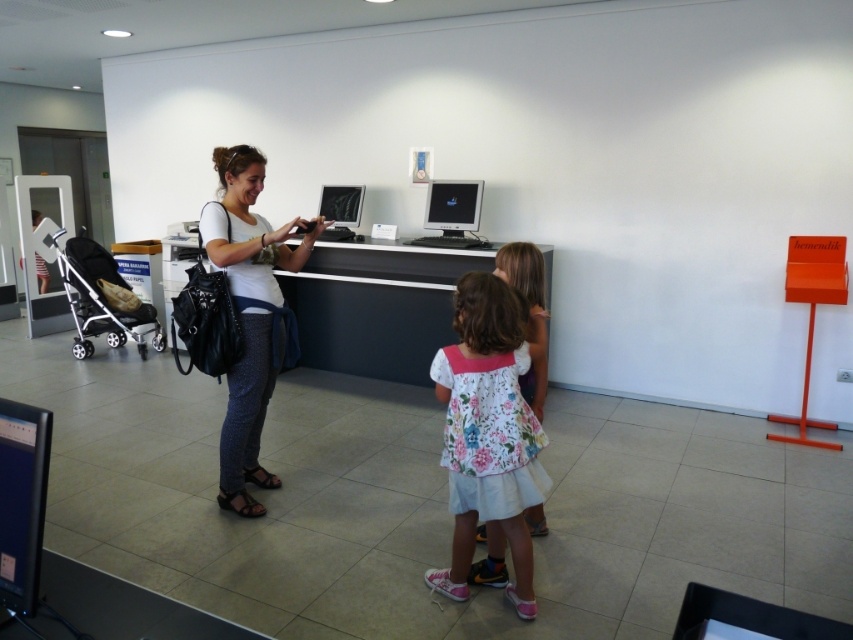
You are standing in the reception area and want to take a photo of both the point at coordinates (498, 320) and the point at coordinates (309, 221). Which point should you focus on first to ensure both are in clear view?

You should focus on point (498, 320) first because it is closer to the camera than point (309, 221). This ensures both points are in focus as you adjust the focus from near to far.

You are a delivery person who needs to place a small package on the desk. The package is 18 inches long. Can you place it horizontally between the white glossy desk at center and the matte silver monitor at center without overlapping either?

The distance between the white glossy desk at center and the matte silver monitor at center is 18.32 inches. Since the package is 18 inches long, it can fit horizontally between them without overlapping either.